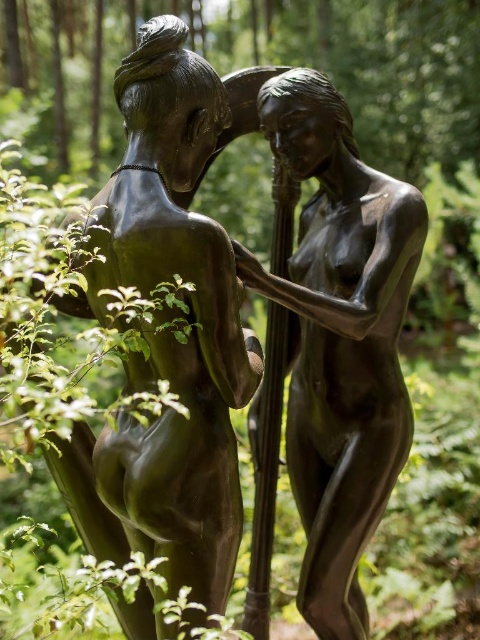
You are an art student analyzing the composition of the sculpture arrangement in the image. The scene has a point at coordinates (167, 333). What does this point represent in the image?

The point at coordinates (167, 333) indicates the bronze statue at center.